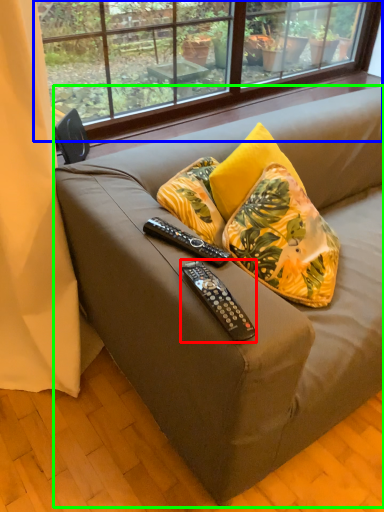
Question: Based on their relative distances, which object is nearer to remote control (highlighted by a red box)? Choose from window (highlighted by a blue box) and studio couch (highlighted by a green box).

Choices:
 (A) window
 (B) studio couch

Answer: (B)